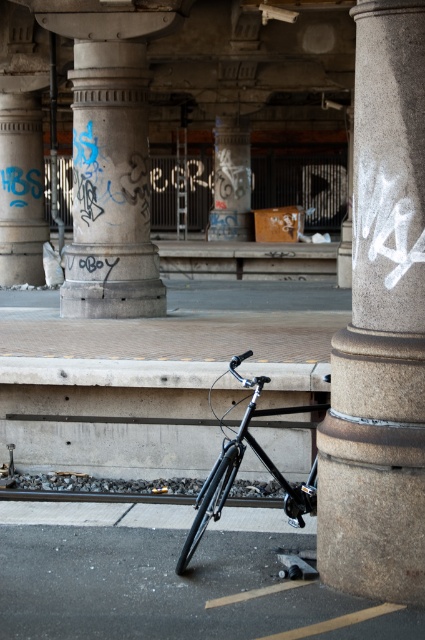
Who is higher up, granite column at center or smooth concrete pillar at center?

smooth concrete pillar at center is higher up.

Does granite column at center have a smaller size compared to smooth concrete pillar at center?

Yes.

Which is behind, point (340, 436) or point (223, 145)?

The point (223, 145) is more distant.

Locate an element on the screen. The height and width of the screenshot is (640, 425). granite column at center is located at coordinates (379, 326).

Which is in front, point (62, 296) or point (235, 166)?

Point (62, 296)

Can you confirm if concrete textured pillar at center is smaller than smooth concrete pillar at center?

Indeed, concrete textured pillar at center has a smaller size compared to smooth concrete pillar at center.

Is point (119, 83) closer to camera compared to point (217, 156)?

Yes, it is in front of point (217, 156).

Locate an element on the screen. The height and width of the screenshot is (640, 425). concrete textured pillar at center is located at coordinates (110, 188).

Does granite column at center have a smaller size compared to black asphalt at lower center?

No, granite column at center is not smaller than black asphalt at lower center.

Is granite column at center wider than black asphalt at lower center?

No, granite column at center is not wider than black asphalt at lower center.

Between point (413, 172) and point (27, 605), which one is positioned behind?

The point (27, 605) is more distant.

The height and width of the screenshot is (640, 425). Identify the location of granite column at center. (379, 326).